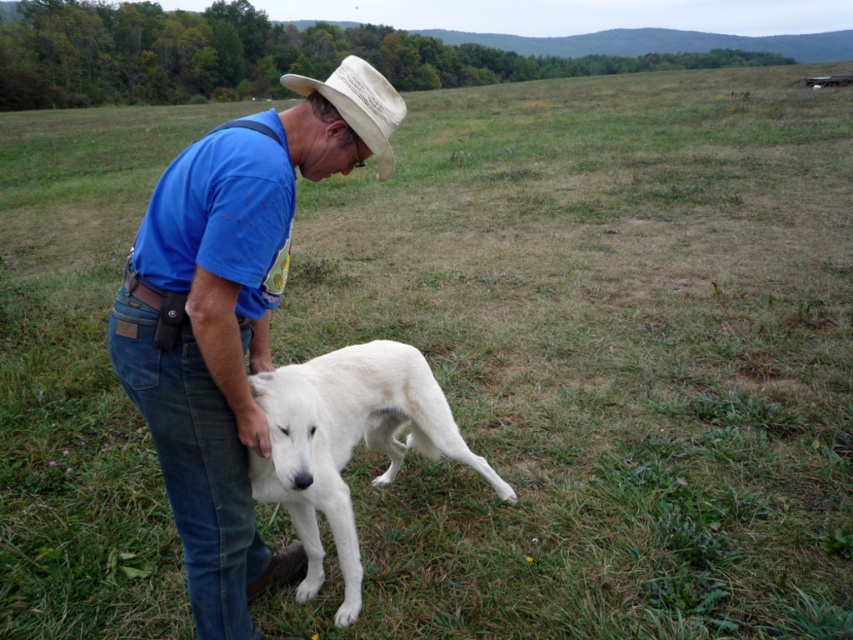
Is point (161, 244) positioned in front of point (299, 417)?

Yes, point (161, 244) is in front of point (299, 417).

Can you confirm if blue cotton shirt at center is positioned to the right of white fur dog at lower left?

Incorrect, blue cotton shirt at center is not on the right side of white fur dog at lower left.

I want to click on blue cotton shirt at center, so click(x=230, y=317).

Identify the location of blue cotton shirt at center. The height and width of the screenshot is (640, 853). (230, 317).

Can you confirm if blue cotton shirt at center is taller than beige fabric cowboy hat at center?

In fact, blue cotton shirt at center may be shorter than beige fabric cowboy hat at center.

What are the coordinates of `blue cotton shirt at center` in the screenshot? It's located at (230, 317).

Is white fur dog at lower left positioned in front of beige fabric cowboy hat at center?

Yes, it is.

Does point (438, 387) come closer to viewer compared to point (386, 170)?

That is False.

Where is `white fur dog at lower left`? white fur dog at lower left is located at coordinates (347, 444).